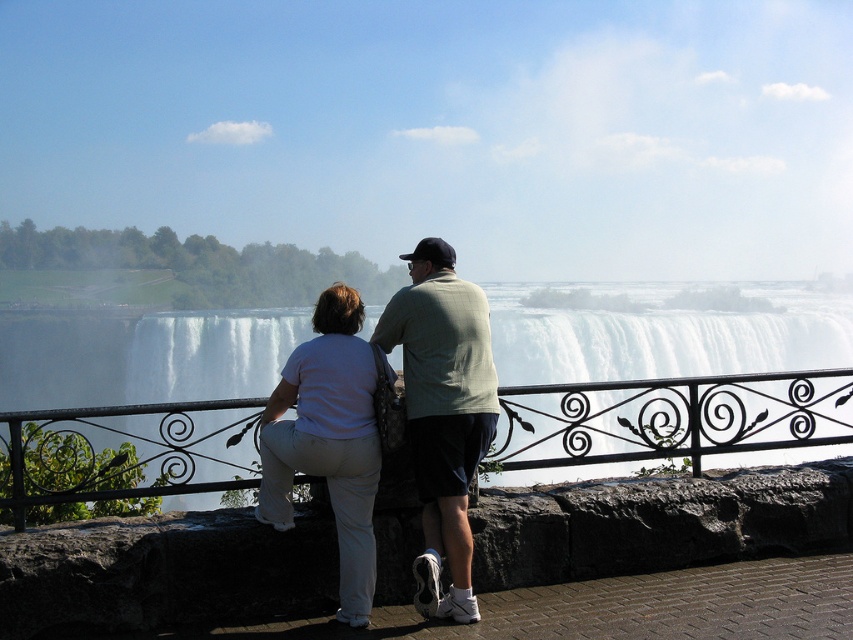
Does white frothy water at center lie in front of light green cotton shirt at center?

No, it is not.

Measure the distance between white frothy water at center and camera.

6.35 meters

I want to click on white frothy water at center, so click(670, 417).

Looking at this image, is black wrought iron railing at center behind white frothy water at center?

No, black wrought iron railing at center is closer to the viewer.

Who is more distant from viewer, (207, 484) or (592, 385)?

The point (592, 385) is behind.

Does point (155, 493) come behind point (566, 348)?

No, (155, 493) is closer to viewer.

Where is `black wrought iron railing at center`? Image resolution: width=853 pixels, height=640 pixels. black wrought iron railing at center is located at coordinates (670, 417).

Is black wrought iron railing at center thinner than white cotton pants at center?

In fact, black wrought iron railing at center might be wider than white cotton pants at center.

Who is more distant from viewer, (196, 406) or (351, 438)?

Positioned behind is point (196, 406).

Locate an element on the screen. This screenshot has height=640, width=853. black wrought iron railing at center is located at coordinates (670, 417).